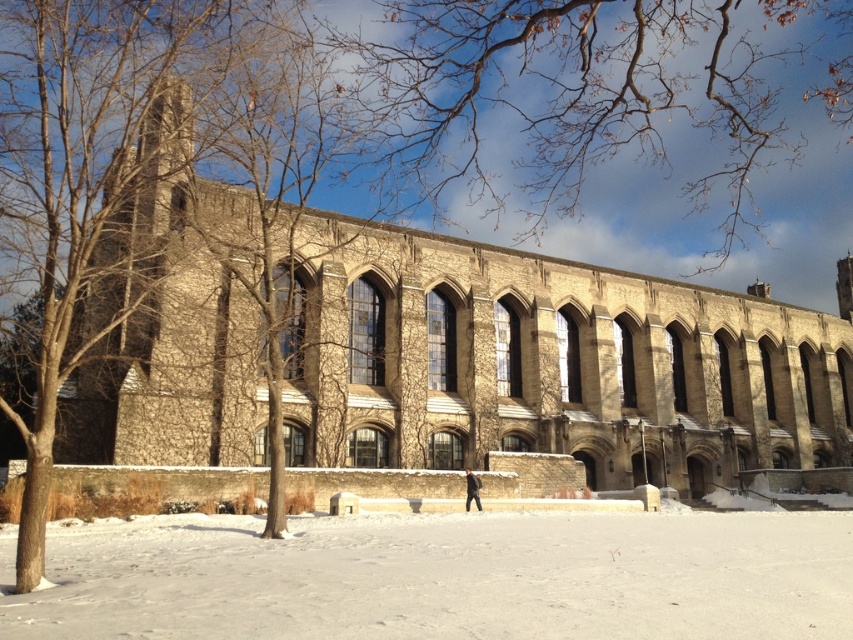
Can you confirm if brown stone church at center is positioned below white powdery snow at lower center?

A: No, brown stone church at center is not below white powdery snow at lower center.

Is brown stone church at center above white powdery snow at lower center?

Yes.

Is point (419, 280) positioned in front of point (494, 628)?

No.

Locate an element on the screen. This screenshot has height=640, width=853. brown stone church at center is located at coordinates (550, 364).